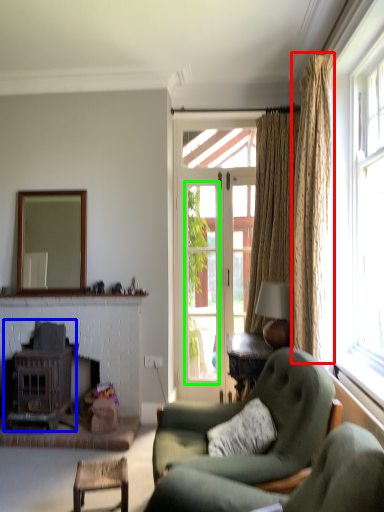
Question: Based on their relative distances, which object is nearer to curtain (highlighted by a red box)? Choose from stove (highlighted by a blue box) and window screen (highlighted by a green box).

Choices:
 (A) stove
 (B) window screen

Answer: (B)